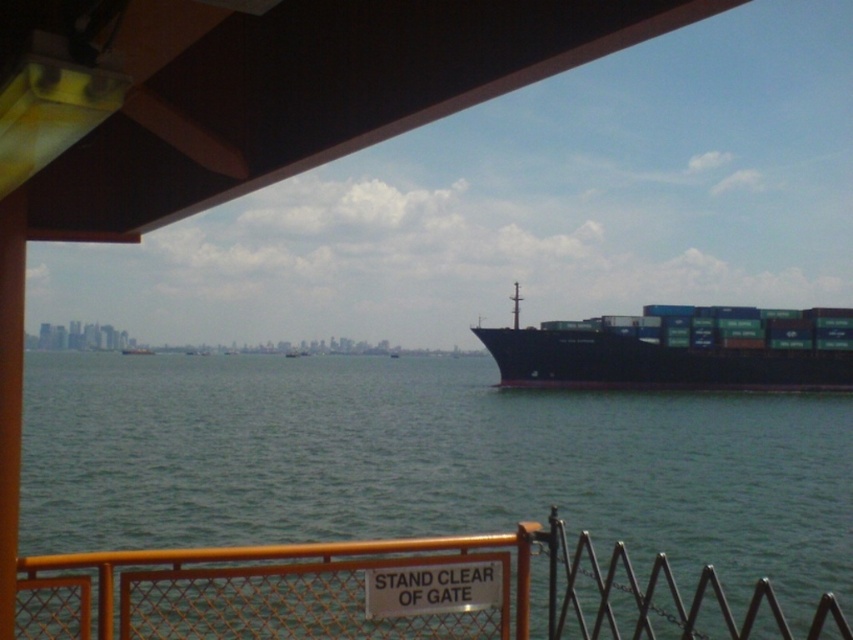
Is black matte container ship at right below green matte container ship at center?

No.

This screenshot has width=853, height=640. I want to click on black matte container ship at right, so click(679, 349).

Who is positioned more to the left, green water at lower center or black matte container ship at right?

green water at lower center is more to the left.

Between green water at lower center and black matte container ship at right, which one is positioned higher?

black matte container ship at right is above.

Does point (404, 371) come farther from viewer compared to point (728, 355)?

Yes, point (404, 371) is behind point (728, 355).

This screenshot has width=853, height=640. Identify the location of green water at lower center. (426, 460).

Which is more to the right, green water at lower center or green matte container ship at center?

green water at lower center

Does green water at lower center appear over green matte container ship at center?

No, green water at lower center is not above green matte container ship at center.

Between point (384, 472) and point (126, 353), which one is positioned behind?

The point (126, 353) is behind.

I want to click on green water at lower center, so click(x=426, y=460).